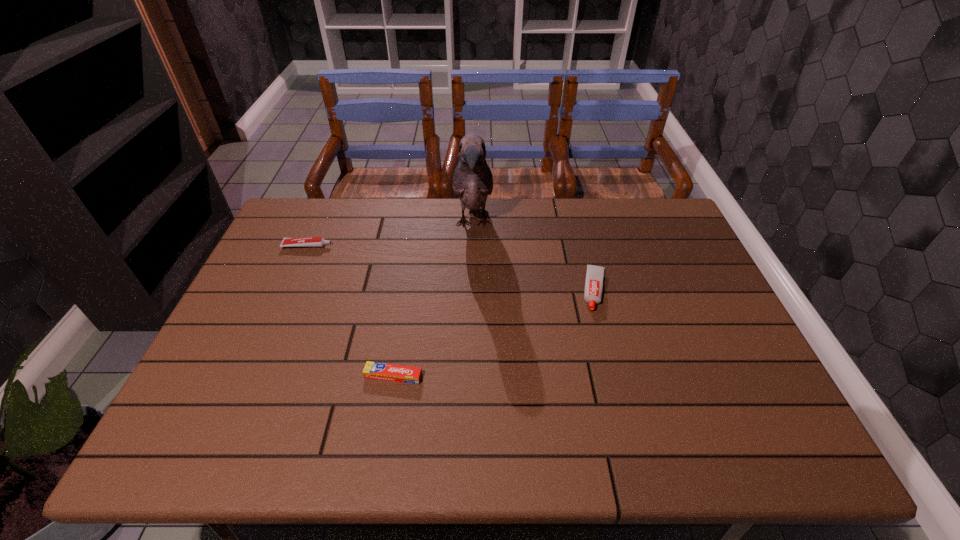
This screenshot has height=540, width=960. I want to click on free spot between the third shortest object and the second object from left to right, so pos(494,333).

You are a GUI agent. You are given a task and a screenshot of the screen. Output one action in this format:
    pyautogui.click(x=<x>, y=<y>)
    Task: Click on the vacant area between the rightmost toothpaste and the leftmost object
    
    Given the screenshot: What is the action you would take?
    pyautogui.click(x=451, y=268)

The height and width of the screenshot is (540, 960). In order to click on vacant space in between the parrot and the leftmost object in this screenshot , I will do `click(391, 235)`.

This screenshot has height=540, width=960. I want to click on free space between the tallest object and the second tallest toothpaste, so click(x=391, y=235).

This screenshot has height=540, width=960. Identify the location of free point between the shortest toothpaste and the third object from left to right. (434, 300).

This screenshot has height=540, width=960. In order to click on free point between the shortest toothpaste and the second object from right to left in this screenshot , I will do `click(434, 300)`.

Locate an element on the screen. free space that is in between the third object from left to right and the nearest toothpaste is located at coordinates (434, 300).

Where is `free spot between the second nearest toothpaste and the second toothpaste from right to left`? free spot between the second nearest toothpaste and the second toothpaste from right to left is located at coordinates click(x=494, y=333).

This screenshot has width=960, height=540. What are the coordinates of `vacant space that's between the second object from right to left and the nearest object` in the screenshot? It's located at (434, 300).

Locate an element on the screen. vacant region between the rightmost toothpaste and the second toothpaste from right to left is located at coordinates (494, 333).